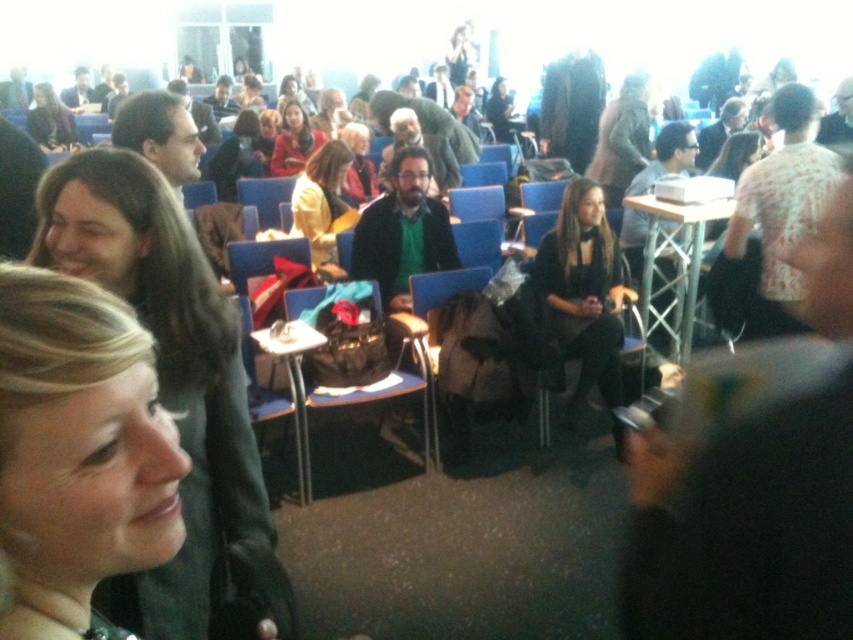
Between wooden table at center and matte black jacket at center, which one appears on the left side from the viewer's perspective?

From the viewer's perspective, matte black jacket at center appears more on the left side.

Which is in front, point (669, 248) or point (360, 189)?

Point (669, 248)

Does point (688, 205) come farther from viewer compared to point (347, 122)?

That is False.

Locate an element on the screen. The height and width of the screenshot is (640, 853). wooden table at center is located at coordinates pyautogui.click(x=672, y=268).

Does point (683, 336) come closer to viewer compared to point (303, 138)?

Yes, it is.

Is point (643, 292) in front of point (283, 113)?

Yes.

Where is `wooden table at center`? wooden table at center is located at coordinates click(x=672, y=268).

Is matte yellow jacket at center to the left of matte black jacket at upper left from the viewer's perspective?

Incorrect, matte yellow jacket at center is not on the left side of matte black jacket at upper left.

Does matte yellow jacket at center have a greater height compared to matte black jacket at upper left?

In fact, matte yellow jacket at center may be shorter than matte black jacket at upper left.

Is point (323, 259) behind point (41, 140)?

No, it is not.

In order to click on matte yellow jacket at center in this screenshot , I will do point(323,205).